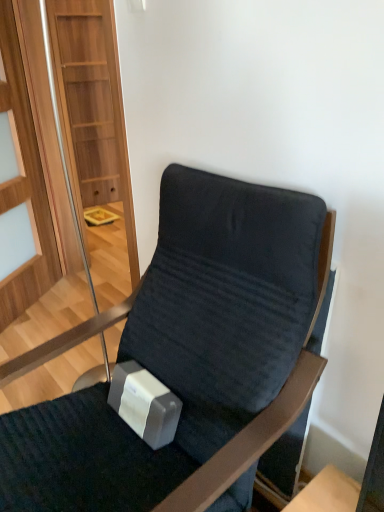
What do you see at coordinates (25, 177) in the screenshot? The height and width of the screenshot is (512, 384). I see `transparent glass door at left` at bounding box center [25, 177].

Where is `transparent glass door at left`? Image resolution: width=384 pixels, height=512 pixels. transparent glass door at left is located at coordinates (25, 177).

Measure the distance between velvet dark blue chair at center and camera.

velvet dark blue chair at center and camera are 32.02 inches apart from each other.

What do you see at coordinates (186, 358) in the screenshot? The width and height of the screenshot is (384, 512). I see `velvet dark blue chair at center` at bounding box center [186, 358].

Where is `velvet dark blue chair at center`? The height and width of the screenshot is (512, 384). velvet dark blue chair at center is located at coordinates (186, 358).

The height and width of the screenshot is (512, 384). I want to click on transparent glass door at left, so click(x=25, y=177).

Does transparent glass door at left appear on the left side of velvet dark blue chair at center?

Yes.

Is transparent glass door at left closer to camera compared to velvet dark blue chair at center?

No, it is not.

Does point (5, 371) come farther from viewer compared to point (232, 494)?

Yes.

From the image's perspective, who appears lower, transparent glass door at left or velvet dark blue chair at center?

From the image's view, velvet dark blue chair at center is below.

Looking at this image, from a real-world perspective, is transparent glass door at left on top of velvet dark blue chair at center?

Yes.

Based on the photo, considering the sizes of objects transparent glass door at left and velvet dark blue chair at center in the image provided, who is wider, transparent glass door at left or velvet dark blue chair at center?

velvet dark blue chair at center is wider.

Is transparent glass door at left shorter than velvet dark blue chair at center?

Incorrect, the height of transparent glass door at left does not fall short of that of velvet dark blue chair at center.

Is transparent glass door at left smaller than velvet dark blue chair at center?

Correct, transparent glass door at left occupies less space than velvet dark blue chair at center.

Is transparent glass door at left inside or outside of velvet dark blue chair at center?

transparent glass door at left cannot be found inside velvet dark blue chair at center.

Is transparent glass door at left in contact with velvet dark blue chair at center?

transparent glass door at left and velvet dark blue chair at center are not in contact.

Could you tell me if transparent glass door at left is turned towards velvet dark blue chair at center?

No, transparent glass door at left is not oriented towards velvet dark blue chair at center.

Identify the location of chair below the transparent glass door at left (from the image's perspective). 186,358.

Which object is positioned more to the left, velvet dark blue chair at center or transparent glass door at left?

transparent glass door at left is more to the left.

Is velvet dark blue chair at center closer to camera compared to transparent glass door at left?

Yes, the depth of velvet dark blue chair at center is less than that of transparent glass door at left.

Which is in front, point (175, 434) or point (102, 325)?

Point (175, 434)

From the image's perspective, would you say velvet dark blue chair at center is shown under transparent glass door at left?

Yes, from the image's perspective, velvet dark blue chair at center is beneath transparent glass door at left.

From a real-world perspective, does velvet dark blue chair at center sit lower than transparent glass door at left?

Yes, from a real-world perspective, velvet dark blue chair at center is below transparent glass door at left.

Which of these two, velvet dark blue chair at center or transparent glass door at left, is thinner?

transparent glass door at left.

Which of these two, velvet dark blue chair at center or transparent glass door at left, stands shorter?

Standing shorter between the two is velvet dark blue chair at center.

Between velvet dark blue chair at center and transparent glass door at left, which one has smaller size?

Smaller between the two is transparent glass door at left.

Is velvet dark blue chair at center not inside transparent glass door at left?

Indeed, velvet dark blue chair at center is completely outside transparent glass door at left.

Is the surface of velvet dark blue chair at center in direct contact with transparent glass door at left?

No, velvet dark blue chair at center is not with transparent glass door at left.

Is velvet dark blue chair at center facing towards transparent glass door at left?

No, velvet dark blue chair at center is not aimed at transparent glass door at left.

What's the angular difference between velvet dark blue chair at center and transparent glass door at left's facing directions?

The facing directions of velvet dark blue chair at center and transparent glass door at left are 0.113 degrees apart.

Locate an element on the screen. The height and width of the screenshot is (512, 384). chair that appears below the transparent glass door at left (from a real-world perspective) is located at coordinates (186, 358).

Locate an element on the screen. Image resolution: width=384 pixels, height=512 pixels. glass door above the velvet dark blue chair at center (from the image's perspective) is located at coordinates (25, 177).

Find the location of a particular element. chair in front of the transparent glass door at left is located at coordinates (186, 358).